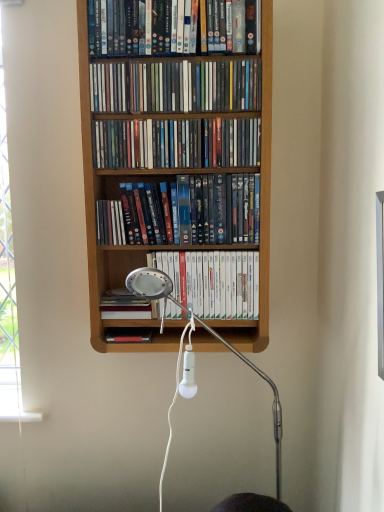
The image size is (384, 512). Describe the element at coordinates (176, 143) in the screenshot. I see `matte plastic dvds at center, positioned as the 4th book in bottom-to-top order` at that location.

Find the location of a particular element. The height and width of the screenshot is (512, 384). hardcover book at center, the sixth book from the top is located at coordinates (124, 305).

Where is `matte plastic dvds at center, acting as the third book starting from the top`? matte plastic dvds at center, acting as the third book starting from the top is located at coordinates (176, 143).

Where is `the 2nd book directly beneath the wooden bookcase at center (from a real-world perspective)`? Image resolution: width=384 pixels, height=512 pixels. the 2nd book directly beneath the wooden bookcase at center (from a real-world perspective) is located at coordinates (214, 281).

Which of these two, white matte book at center, acting as the second book starting from the bottom, or wooden bookcase at center, stands taller?

wooden bookcase at center is taller.

Is white matte book at center, acting as the second book starting from the bottom, not close to wooden bookcase at center?

No, white matte book at center, acting as the second book starting from the bottom, is in close proximity to wooden bookcase at center.

Where is `lamp below the matte plastic dvds at center, acting as the third book starting from the top (from a real-world perspective)`? lamp below the matte plastic dvds at center, acting as the third book starting from the top (from a real-world perspective) is located at coordinates (207, 331).

From a real-world perspective, is white plastic lamp at center on matte plastic dvds at center, positioned as the 4th book in bottom-to-top order?

No, from a real-world perspective, white plastic lamp at center is not on top of matte plastic dvds at center, positioned as the 4th book in bottom-to-top order.

Does white plastic lamp at center have a smaller size compared to matte plastic dvds at center, acting as the third book starting from the top?

No, white plastic lamp at center is not smaller than matte plastic dvds at center, acting as the third book starting from the top.

Is wooden bookcase at center far away from matte plastic dvds at center, positioned as the 4th book in bottom-to-top order?

They are positioned close to each other.

Can matte plastic dvds at center, positioned as the 4th book in bottom-to-top order, be found inside wooden bookcase at center?

Absolutely, matte plastic dvds at center, positioned as the 4th book in bottom-to-top order, is inside wooden bookcase at center.

Is point (174, 172) farther from camera compared to point (215, 161)?

Yes, point (174, 172) is farther from viewer.

Is wooden bookcase at center smaller than matte plastic dvds at center, positioned as the 4th book in bottom-to-top order?

No.

Is matte plastic dvds at center, acting as the third book starting from the top, taller or shorter than white plastic lamp at center?

In the image, matte plastic dvds at center, acting as the third book starting from the top, appears to be shorter than white plastic lamp at center.

Is matte plastic dvds at center, acting as the third book starting from the top, placed right next to white plastic lamp at center?

No, matte plastic dvds at center, acting as the third book starting from the top, is not next to white plastic lamp at center.

Is point (164, 148) positioned before point (278, 475)?

That is True.

From the picture: Is matte plastic dvds at center, acting as the third book starting from the top, not inside white plastic lamp at center?

Yes, matte plastic dvds at center, acting as the third book starting from the top, is not within white plastic lamp at center.

Looking at this image, which object is positioned more to the left, wooden bookcase at center or white matte book at center, acting as the second book starting from the bottom?

wooden bookcase at center.

Is wooden bookcase at center looking in the opposite direction of white matte book at center, acting as the second book starting from the bottom?

Yes, wooden bookcase at center's orientation is away from white matte book at center, acting as the second book starting from the bottom.

How different are the orientations of wooden bookcase at center and white matte book at center, acting as the second book starting from the bottom, in degrees?

The angle between the facing direction of wooden bookcase at center and the facing direction of white matte book at center, acting as the second book starting from the bottom, is 0.319 degrees.

In the scene shown: Does wooden bookcase at center have a greater height compared to white matte book at center, acting as the second book starting from the bottom?

Indeed, wooden bookcase at center has a greater height compared to white matte book at center, acting as the second book starting from the bottom.

Is wooden shelf at upper center, placed as the second book when sorted from top to bottom, located outside matte plastic dvds at center, acting as the third book starting from the top?

wooden shelf at upper center, placed as the second book when sorted from top to bottom, lies outside matte plastic dvds at center, acting as the third book starting from the top,'s area.

Is point (92, 100) behind point (136, 155)?

No, it is in front of (136, 155).

In the scene shown: Is wooden shelf at upper center, the 5th book ordered from the bottom, to the right of matte plastic dvds at center, acting as the third book starting from the top, from the viewer's perspective?

No.

From the image's perspective, is wooden shelf at upper center, placed as the second book when sorted from top to bottom, above or below matte plastic dvds at center, positioned as the 4th book in bottom-to-top order?

Clearly, from the image's perspective, wooden shelf at upper center, placed as the second book when sorted from top to bottom, is above matte plastic dvds at center, positioned as the 4th book in bottom-to-top order.

Is white matte book at center, the fifth book viewed from the top, bigger or smaller than wooden shelf at upper center, the 5th book ordered from the bottom?

white matte book at center, the fifth book viewed from the top, is bigger than wooden shelf at upper center, the 5th book ordered from the bottom.

What are the coordinates of `book that is the 3rd object directly below the wooden shelf at upper center, the 5th book ordered from the bottom (from a real-world perspective)` in the screenshot? It's located at pos(214,281).

Is wooden shelf at upper center, placed as the second book when sorted from top to bottom, at the back of white matte book at center, the fifth book viewed from the top?

That's not correct — white matte book at center, the fifth book viewed from the top, is not looking away from wooden shelf at upper center, placed as the second book when sorted from top to bottom.

Is white matte book at center, the fifth book viewed from the top, not within wooden shelf at upper center, placed as the second book when sorted from top to bottom?

Yes.

The height and width of the screenshot is (512, 384). What are the coordinates of `the 5th book behind when counting from the wooden bookcase at center` in the screenshot? It's located at (214, 281).

You are a GUI agent. You are given a task and a screenshot of the screen. Output one action in this format:
    pyautogui.click(x=<x>, y=<y>)
    Task: Click on the lamp in front of the matte plastic dvds at center, positioned as the 4th book in bottom-to-top order
    The image size is (384, 512).
    Given the screenshot: What is the action you would take?
    pyautogui.click(x=207, y=331)

Estimate the real-world distances between objects in this image. Which object is closer to wooden shelf at upper center, the 5th book ordered from the bottom, hardcover book at center, which appears as the 1th book when ordered from the bottom, or matte plastic dvds at center, positioned as the 4th book in bottom-to-top order?

matte plastic dvds at center, positioned as the 4th book in bottom-to-top order, is positioned closer to the anchor wooden shelf at upper center, the 5th book ordered from the bottom.

Estimate the real-world distances between objects in this image. Which object is closer to white plastic lamp at center, matte plastic dvds at upper center, which appears as the 1th book when viewed from the top, or wooden bookcase at center?

wooden bookcase at center.

Considering their positions, is white plastic lamp at center positioned further to hardcover book at center, the sixth book from the top, than wooden shelf at upper center, the 5th book ordered from the bottom?

Based on the image, wooden shelf at upper center, the 5th book ordered from the bottom, appears to be further to hardcover book at center, the sixth book from the top.

Estimate the real-world distances between objects in this image. Which object is closer to white plastic lamp at center, hardcover book at center, which appears as the 1th book when ordered from the bottom, or matte black dvds at center, which is the 4th book from top to bottom?

hardcover book at center, which appears as the 1th book when ordered from the bottom.

From the image, which object appears to be farther from matte black dvds at center, which is the 4th book from top to bottom, white plastic lamp at center or hardcover book at center, the sixth book from the top?

hardcover book at center, the sixth book from the top.

Which object lies nearer to the anchor point wooden bookcase at center, white plastic lamp at center or matte black dvds at center, which is the 4th book from top to bottom?

Based on the image, matte black dvds at center, which is the 4th book from top to bottom, appears to be nearer to wooden bookcase at center.

When comparing their distances from matte black dvds at center, which ranks as the third book in bottom-to-top order, does white plastic lamp at center or matte plastic dvds at center, positioned as the 4th book in bottom-to-top order, seem further?

Among the two, white plastic lamp at center is located further to matte black dvds at center, which ranks as the third book in bottom-to-top order.

Based on their spatial positions, is wooden shelf at upper center, placed as the second book when sorted from top to bottom, or matte black dvds at center, which is the 4th book from top to bottom, closer to wooden bookcase at center?

Among the two, matte black dvds at center, which is the 4th book from top to bottom, is located nearer to wooden bookcase at center.

In order to click on bookcase between matte plastic dvds at upper center, which is the sixth book in bottom-to-top order, and matte black dvds at center, which ranks as the third book in bottom-to-top order, from top to bottom in this screenshot , I will do `click(95, 225)`.

This screenshot has height=512, width=384. What are the coordinates of `book between matte plastic dvds at center, positioned as the 4th book in bottom-to-top order, and white matte book at center, acting as the second book starting from the bottom, in the vertical direction` in the screenshot? It's located at (183, 212).

Image resolution: width=384 pixels, height=512 pixels. Find the location of `bookcase between wooden shelf at upper center, the 5th book ordered from the bottom, and white matte book at center, acting as the second book starting from the bottom, in the vertical direction`. bookcase between wooden shelf at upper center, the 5th book ordered from the bottom, and white matte book at center, acting as the second book starting from the bottom, in the vertical direction is located at coordinates (95, 225).

This screenshot has width=384, height=512. In order to click on book between wooden shelf at upper center, placed as the second book when sorted from top to bottom, and wooden bookcase at center vertically in this screenshot , I will do coord(176,143).